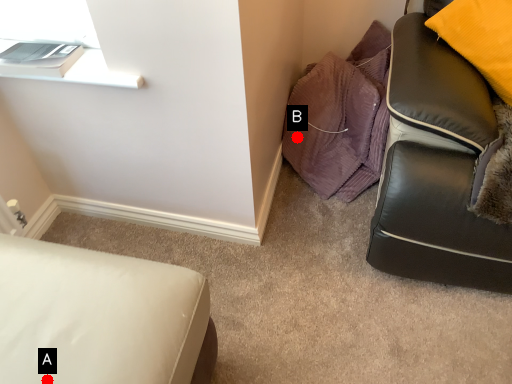
Question: Two points are circled on the image, labeled by A and B beside each circle. Which point is closer to the camera?

Choices:
 (A) A is closer
 (B) B is closer

Answer: (A)